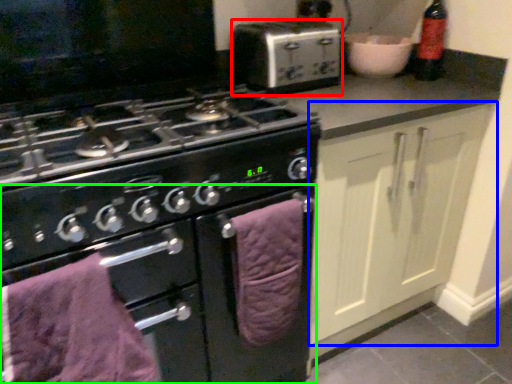
Question: Which is nearer to the kitchen appliance (highlighted by a red box)? cabinetry (highlighted by a blue box) or oven (highlighted by a green box).

Choices:
 (A) cabinetry
 (B) oven

Answer: (A)